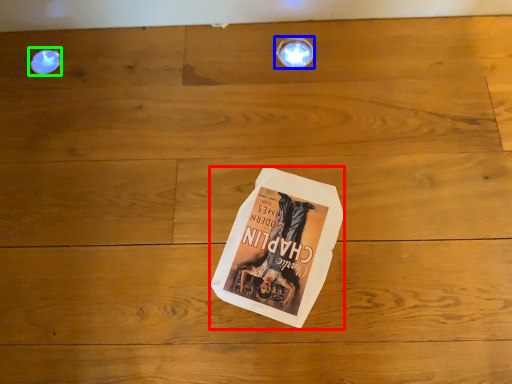
Question: Estimate the real-world distances between objects in this image. Which object is farther from paperback book (highlighted by a red box), light fixture (highlighted by a blue box) or droplight (highlighted by a green box)?

Choices:
 (A) light fixture
 (B) droplight

Answer: (B)